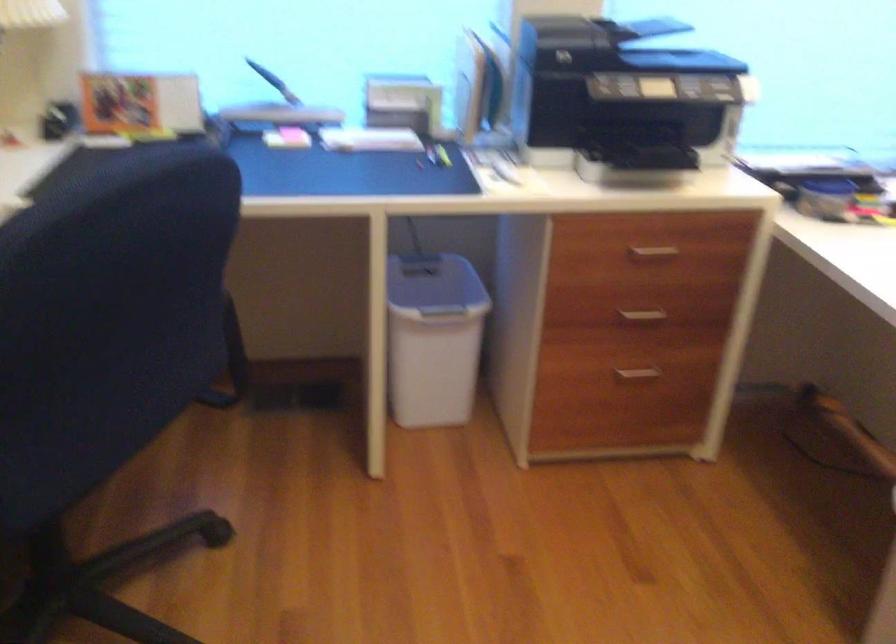
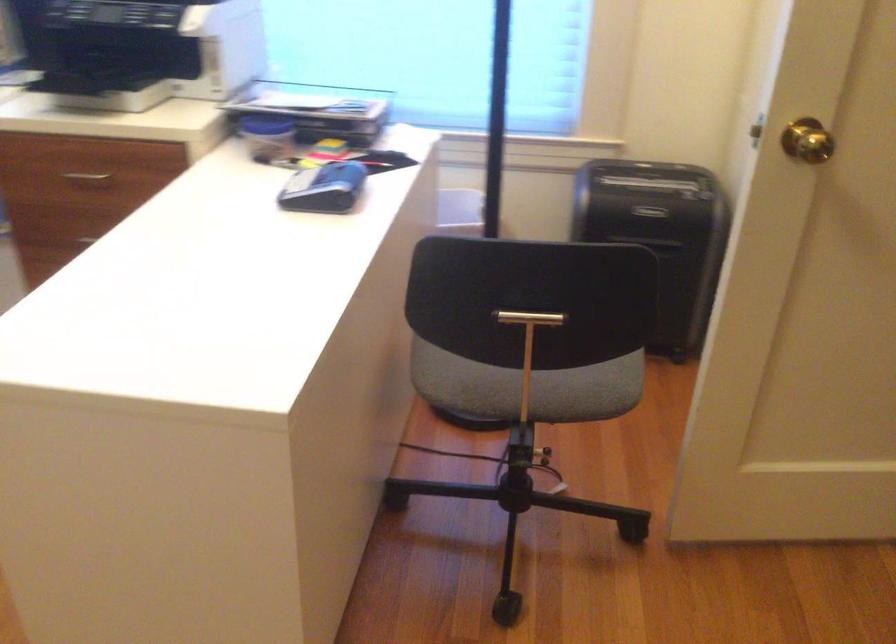
Question: Which direction would the cameraman need to move to produce the second image? Reply with the corresponding letter.

Choices:
 (A) Left
 (B) Right
 (C) Forward
 (D) Backward

Answer: (B)